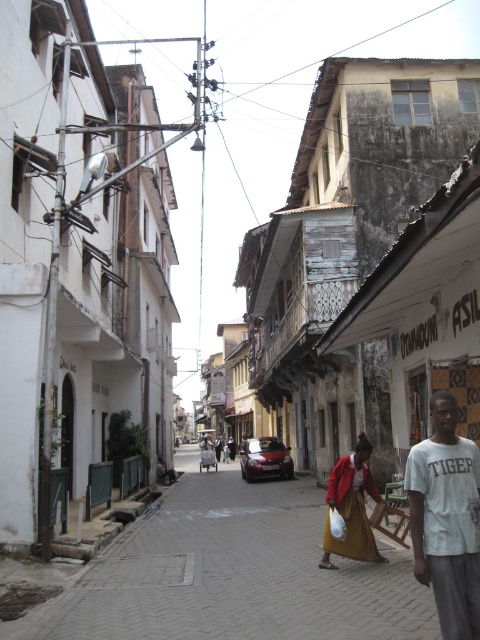
You are a delivery person trying to navigate a narrow street in a small town. You see a brick paved street at center and a red fabric skirt at lower center. Which object is located below the other?

The brick paved street at center is positioned under the red fabric skirt at lower center, meaning the brick paved street is below the red fabric skirt at lower center.

You are standing at the entrance of the green gate on the left side of the street. You want to walk to the brick paved street at center. Which direction should you head?

You should head towards the center of the street to reach the brick paved street at center.